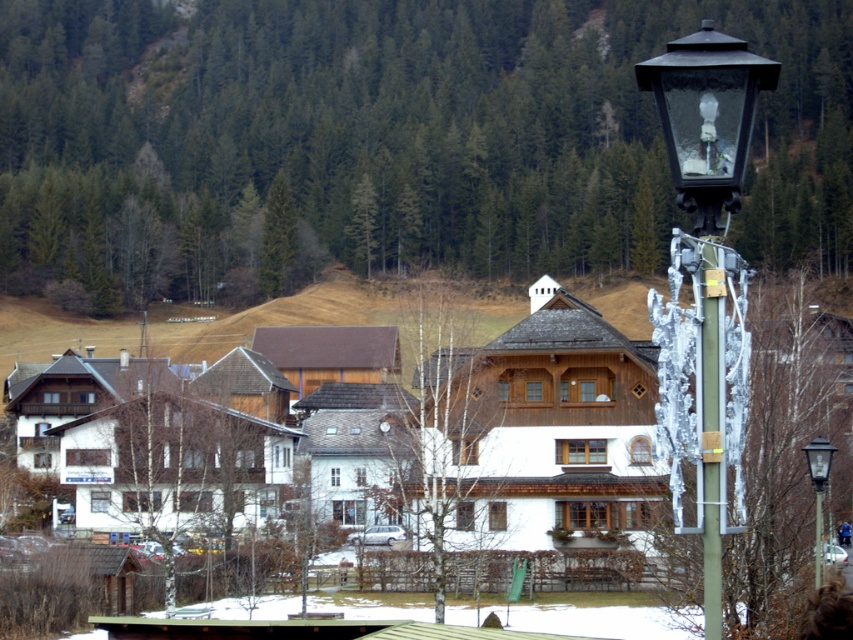
Question: Which point is closer to the camera?

Choices:
 (A) (709, 364)
 (B) (665, 342)
 (C) (305, 300)
 (D) (225, 230)

Answer: (A)

Question: Which of the following is the closest to the observer?

Choices:
 (A) (816, 484)
 (B) (715, 337)

Answer: (B)

Question: Can you confirm if green matte tree at upper center is smaller than bare wood tree at center?

Choices:
 (A) no
 (B) yes

Answer: (A)

Question: Is green matte tree at upper center wider than bare wood tree at center?

Choices:
 (A) yes
 (B) no

Answer: (A)

Question: Does bare wood tree at center appear on the right side of green metallic pole at center-right?

Choices:
 (A) no
 (B) yes

Answer: (A)

Question: Which object appears closest to the camera in this image?

Choices:
 (A) bare wood tree at center
 (B) green metallic pole at center-right
 (C) black glass street light at right
 (D) green matte tree at upper center

Answer: (C)